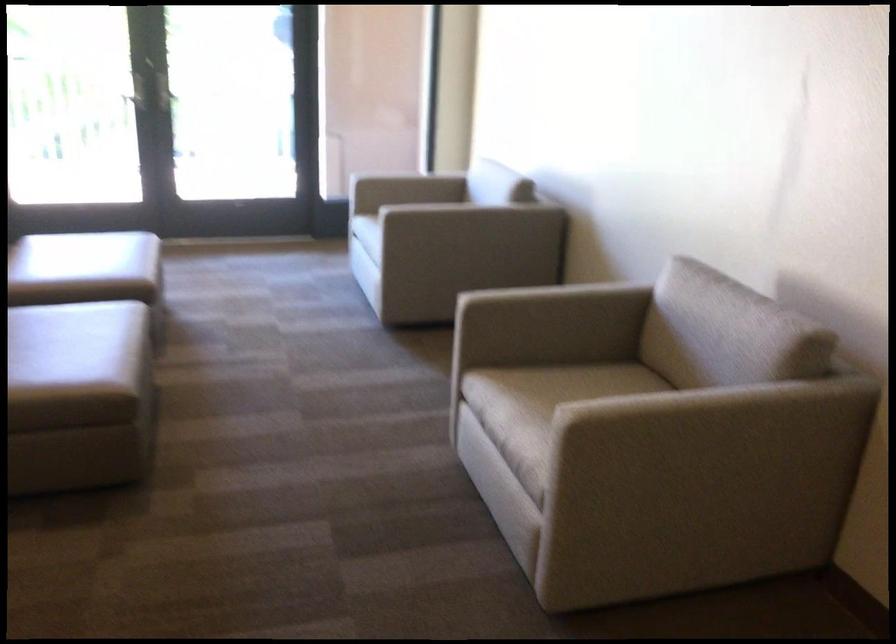
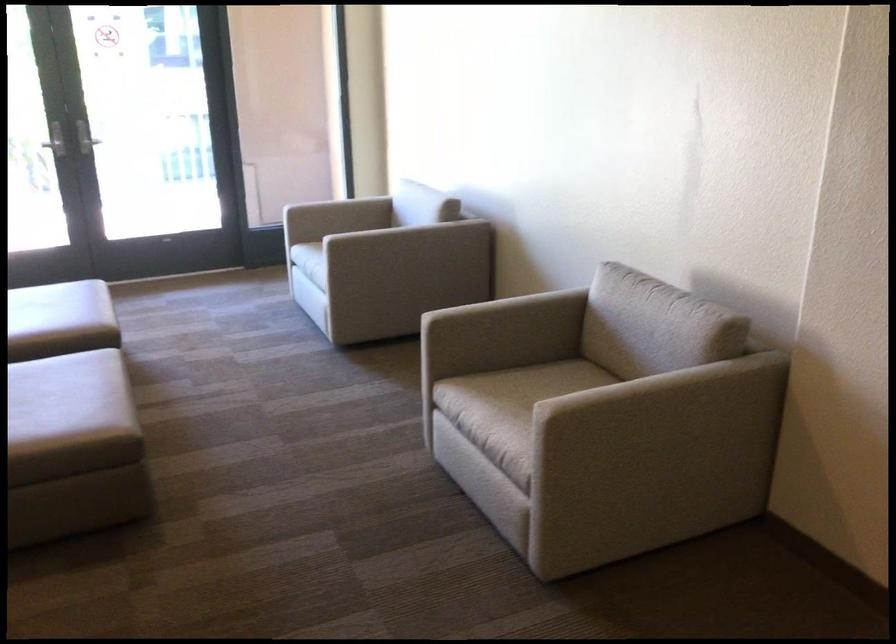
Which direction would the cameraman need to move to produce the second image?

The cameraman walked toward left, backward.